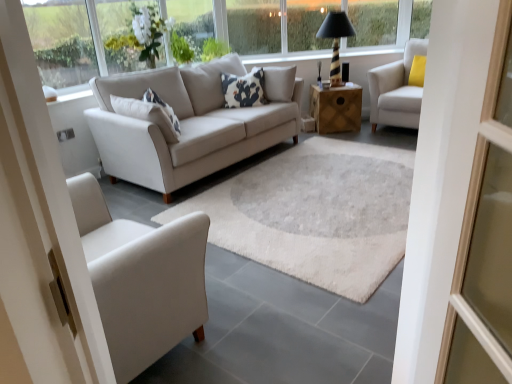
Question: From a real-world perspective, is transparent glass window at upper center, which ranks as the second window in left-to-right order, beneath transparent glass window at upper center, the 5th window from the left?

Choices:
 (A) no
 (B) yes

Answer: (A)

Question: Is transparent glass window at upper center, the fifth window from the right, positioned beyond the bounds of transparent glass window at upper center, marked as the second window in a right-to-left arrangement?

Choices:
 (A) yes
 (B) no

Answer: (A)

Question: Can you confirm if transparent glass window at upper center, which ranks as the second window in left-to-right order, is smaller than transparent glass window at upper center, marked as the second window in a right-to-left arrangement?

Choices:
 (A) yes
 (B) no

Answer: (B)

Question: Are transparent glass window at upper center, the fifth window from the right, and transparent glass window at upper center, marked as the second window in a right-to-left arrangement, far apart?

Choices:
 (A) yes
 (B) no

Answer: (A)

Question: Is transparent glass window at upper center, which ranks as the second window in left-to-right order, thinner than transparent glass window at upper center, the 5th window from the left?

Choices:
 (A) no
 (B) yes

Answer: (A)

Question: Considering the relative sizes of transparent glass window at upper center, the fifth window from the right, and transparent glass window at upper center, marked as the second window in a right-to-left arrangement, in the image provided, is transparent glass window at upper center, the fifth window from the right, shorter than transparent glass window at upper center, marked as the second window in a right-to-left arrangement,?

Choices:
 (A) yes
 (B) no

Answer: (B)

Question: From the image's perspective, is wooden side table at center over white fabric armchair at upper right?

Choices:
 (A) no
 (B) yes

Answer: (A)

Question: Does wooden side table at center lie behind white fabric armchair at upper right?

Choices:
 (A) yes
 (B) no

Answer: (A)

Question: Is white fabric armchair at upper right completely or partially inside wooden side table at center?

Choices:
 (A) no
 (B) yes

Answer: (A)

Question: Is wooden side table at center oriented away from white fabric armchair at upper right?

Choices:
 (A) no
 (B) yes

Answer: (A)

Question: Does wooden side table at center have a larger size compared to white fabric armchair at upper right?

Choices:
 (A) no
 (B) yes

Answer: (A)

Question: Considering the relative positions of wooden side table at center and white fabric armchair at upper right in the image provided, is wooden side table at center to the left of white fabric armchair at upper right from the viewer's perspective?

Choices:
 (A) no
 (B) yes

Answer: (B)

Question: From a real-world perspective, is white fabric armchair at upper right physically below wooden side table at center?

Choices:
 (A) yes
 (B) no

Answer: (B)